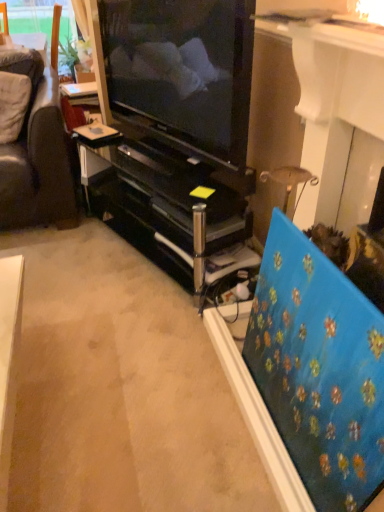
Find the location of a particular element. This screenshot has width=384, height=512. black glossy tv cabinet at center is located at coordinates (165, 201).

In order to click on matte black television at center in this screenshot , I will do pos(183,69).

Where is `blue textured canvas at right`? The width and height of the screenshot is (384, 512). blue textured canvas at right is located at coordinates (319, 369).

Can you confirm if matte black television at center is taller than black glossy tv cabinet at center?

Yes.

Between point (241, 91) and point (187, 288), which one is positioned in front?

The point (241, 91) is closer.

Who is smaller, matte black television at center or black glossy tv cabinet at center?

With smaller size is matte black television at center.

Measure the distance from matte black television at center to black glossy tv cabinet at center.

The distance of matte black television at center from black glossy tv cabinet at center is 12.59 inches.

What's the angular difference between black glossy tv cabinet at center and blue textured canvas at right's facing directions?

20.6 degrees.

From the picture: Which object is positioned more to the left, black glossy tv cabinet at center or blue textured canvas at right?

black glossy tv cabinet at center.

In terms of height, does black glossy tv cabinet at center look taller or shorter compared to blue textured canvas at right?

In the image, black glossy tv cabinet at center appears to be shorter than blue textured canvas at right.

From the image's perspective, which one is positioned lower, black glossy tv cabinet at center or blue textured canvas at right?

blue textured canvas at right, from the image's perspective.

Which object is positioned more to the right, matte black television at center or blue textured canvas at right?

blue textured canvas at right.

How much distance is there between matte black television at center and blue textured canvas at right?

They are 95.38 centimeters apart.

Is matte black television at center next to blue textured canvas at right?

matte black television at center and blue textured canvas at right are clearly separated.

What's the angular difference between matte black television at center and blue textured canvas at right's facing directions?

The angular difference between matte black television at center and blue textured canvas at right is 22.2 degrees.

Is black glossy tv cabinet at center located within blue textured canvas at right?

No, black glossy tv cabinet at center is not a part of blue textured canvas at right.

Is blue textured canvas at right further to the viewer compared to black glossy tv cabinet at center?

No, it is in front of black glossy tv cabinet at center.

From the picture: Is the surface of blue textured canvas at right in direct contact with black glossy tv cabinet at center?

No, blue textured canvas at right is not with black glossy tv cabinet at center.

Can you confirm if blue textured canvas at right is positioned to the right of black glossy tv cabinet at center?

Yes.

How many degrees apart are the facing directions of black glossy tv cabinet at center and matte black television at center?

The angular difference between black glossy tv cabinet at center and matte black television at center is 1.65 degrees.

Is black glossy tv cabinet at center far away from matte black television at center?

black glossy tv cabinet at center is actually quite close to matte black television at center.

Looking at the image, does black glossy tv cabinet at center seem bigger or smaller compared to matte black television at center?

Considering their sizes, black glossy tv cabinet at center takes up more space than matte black television at center.

Which object is positioned more to the left, black glossy tv cabinet at center or matte black television at center?

matte black television at center.

From the picture: Which is more to the right, blue textured canvas at right or matte black television at center?

Positioned to the right is blue textured canvas at right.

In the scene shown: Who is more distant, blue textured canvas at right or matte black television at center?

matte black television at center is behind.

From the image's perspective, which one is positioned higher, blue textured canvas at right or matte black television at center?

matte black television at center, from the image's perspective.

Considering the relative sizes of blue textured canvas at right and matte black television at center in the image provided, is blue textured canvas at right bigger than matte black television at center?

Incorrect, blue textured canvas at right is not larger than matte black television at center.

You are a GUI agent. You are given a task and a screenshot of the screen. Output one action in this format:
    pyautogui.click(x=<x>, y=<y>)
    Task: Click on the tv cabinet on the right of the matte black television at center
    
    Given the screenshot: What is the action you would take?
    pyautogui.click(x=165, y=201)

Image resolution: width=384 pixels, height=512 pixels. I want to click on flat in front of the black glossy tv cabinet at center, so click(x=319, y=369).

Looking at the image, which one is located further to blue textured canvas at right, matte black television at center or black glossy tv cabinet at center?

matte black television at center.

Which object lies further to the anchor point matte black television at center, blue textured canvas at right or black glossy tv cabinet at center?

blue textured canvas at right.

Considering their positions, is black glossy tv cabinet at center positioned further to matte black television at center than blue textured canvas at right?

Among the two, blue textured canvas at right is located further to matte black television at center.

Which object lies further to the anchor point blue textured canvas at right, black glossy tv cabinet at center or matte black television at center?

matte black television at center lies further to blue textured canvas at right than the other object.

When comparing their distances from black glossy tv cabinet at center, does matte black television at center or blue textured canvas at right seem closer?

matte black television at center lies closer to black glossy tv cabinet at center than the other object.

Based on their spatial positions, is blue textured canvas at right or matte black television at center further from black glossy tv cabinet at center?

Based on the image, blue textured canvas at right appears to be further to black glossy tv cabinet at center.

Where is `tv cabinet between matte black television at center and blue textured canvas at right vertically`? tv cabinet between matte black television at center and blue textured canvas at right vertically is located at coordinates (165, 201).